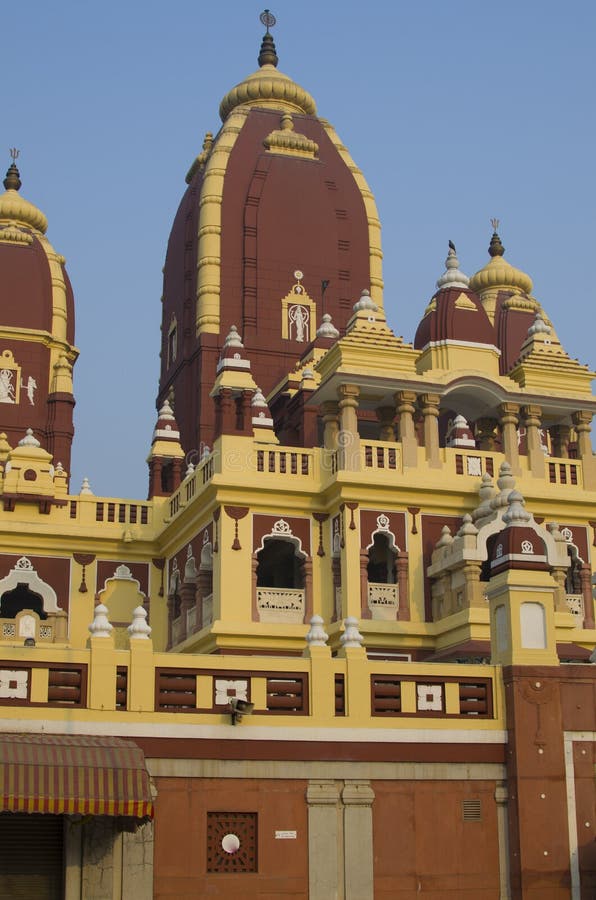
This screenshot has height=900, width=596. I want to click on decorative top, so click(x=15, y=164), click(x=271, y=23), click(x=499, y=227).